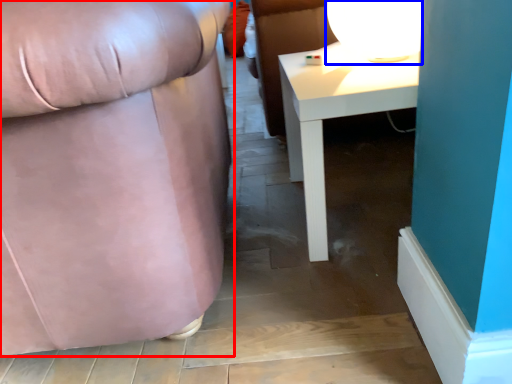
Question: Which object is closer to the camera taking this photo, chair (highlighted by a red box) or table lamp (highlighted by a blue box)?

Choices:
 (A) chair
 (B) table lamp

Answer: (A)